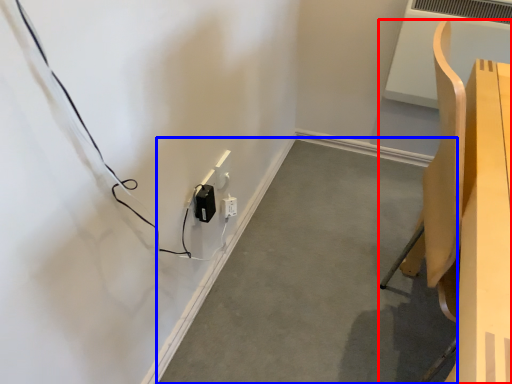
Question: Which object is closer to the camera taking this photo, furniture (highlighted by a red box) or concrete (highlighted by a blue box)?

Choices:
 (A) furniture
 (B) concrete

Answer: (A)